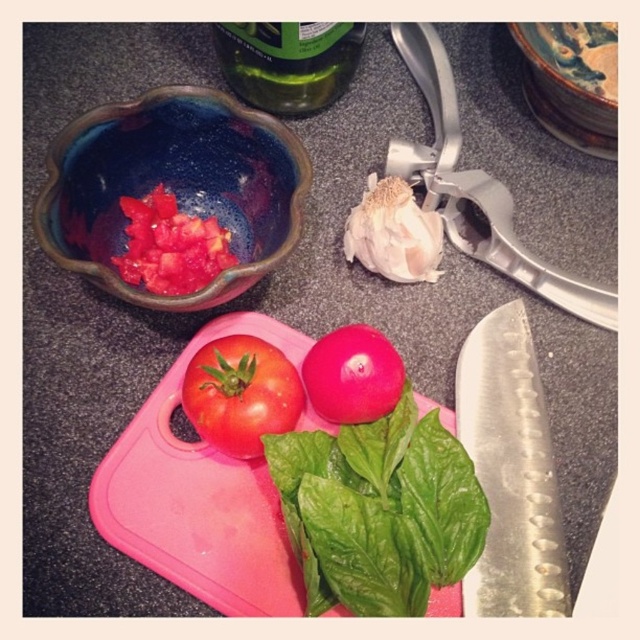
Is green leafy basil at center above red matte tomato at center?

No, green leafy basil at center is not above red matte tomato at center.

This screenshot has height=640, width=640. Describe the element at coordinates (380, 509) in the screenshot. I see `green leafy basil at center` at that location.

The image size is (640, 640). What do you see at coordinates (380, 509) in the screenshot?
I see `green leafy basil at center` at bounding box center [380, 509].

Identify the location of green leafy basil at center. This screenshot has height=640, width=640. (380, 509).

The width and height of the screenshot is (640, 640). What do you see at coordinates (241, 394) in the screenshot?
I see `red matte tomato at center` at bounding box center [241, 394].

The image size is (640, 640). Identify the location of red matte tomato at center. (241, 394).

Does point (252, 445) come closer to viewer compared to point (358, 422)?

That is True.

In order to click on red matte tomato at center in this screenshot , I will do `click(241, 394)`.

Can you confirm if blue glossy bowl at upper left is taller than chopped tomato at center?

Yes, blue glossy bowl at upper left is taller than chopped tomato at center.

How distant is blue glossy bowl at upper left from chopped tomato at center?

A distance of 9.36 centimeters exists between blue glossy bowl at upper left and chopped tomato at center.

Does point (189, 188) lie in front of point (192, 244)?

No, (189, 188) is behind (192, 244).

The width and height of the screenshot is (640, 640). In order to click on blue glossy bowl at upper left in this screenshot , I will do `click(173, 186)`.